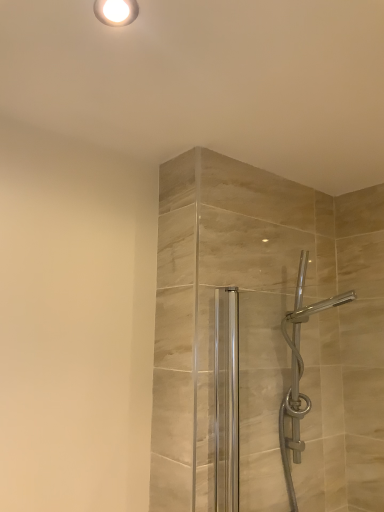
The height and width of the screenshot is (512, 384). What do you see at coordinates (260, 395) in the screenshot? I see `clear glass shower door at center` at bounding box center [260, 395].

Where is `clear glass shower door at center`? The height and width of the screenshot is (512, 384). clear glass shower door at center is located at coordinates (260, 395).

Find the location of a particular element. clear glass shower door at center is located at coordinates (260, 395).